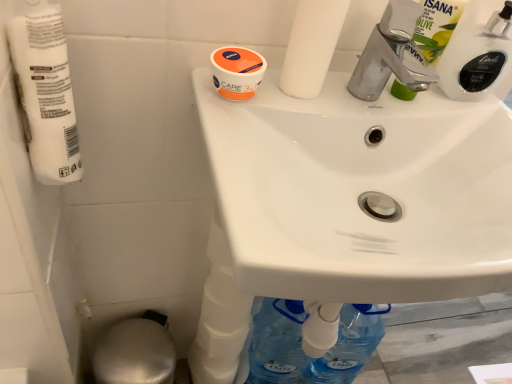
Find the location of a particular element. This screenshot has height=384, width=512. free spot to the right of orange matte jar at upper center is located at coordinates (336, 101).